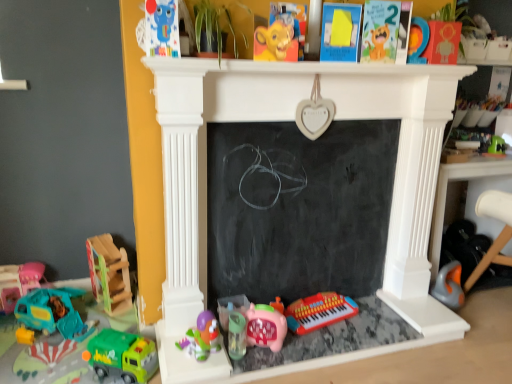
The image size is (512, 384). Find the location of `free point above black chalkboard at center (from a real-world perspective)`. free point above black chalkboard at center (from a real-world perspective) is located at coordinates (308, 121).